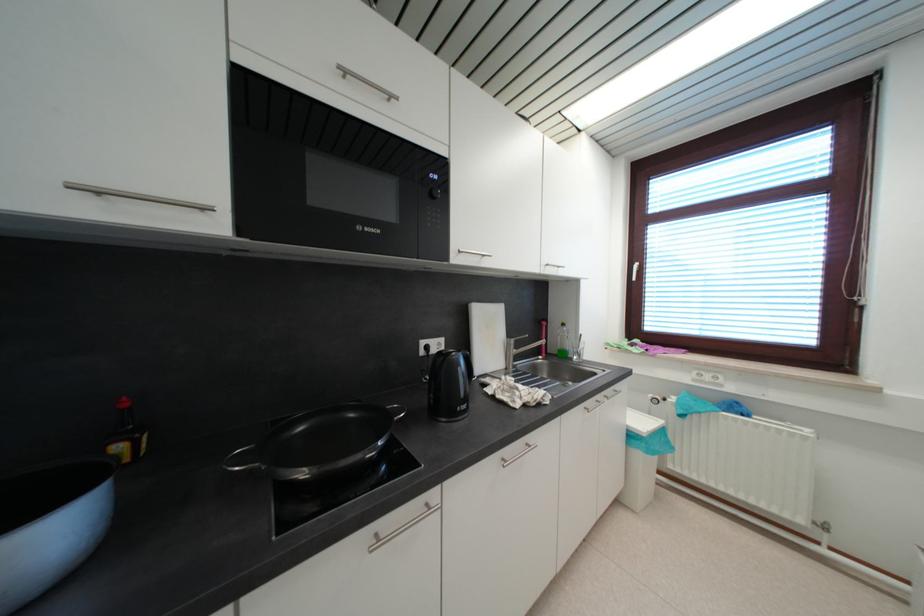
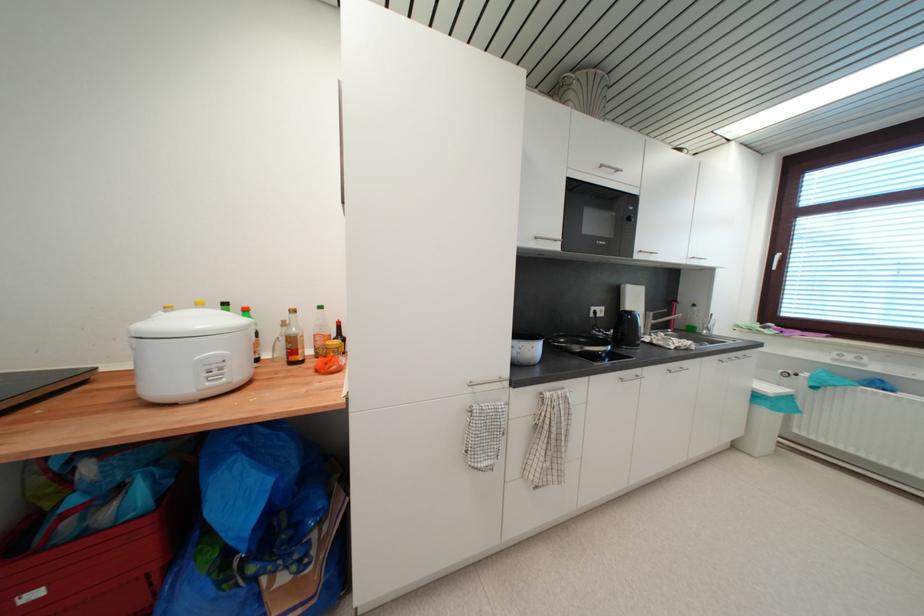
Locate, in the second image, the point that corresponds to the point at 667,432 in the first image.

(795, 400)